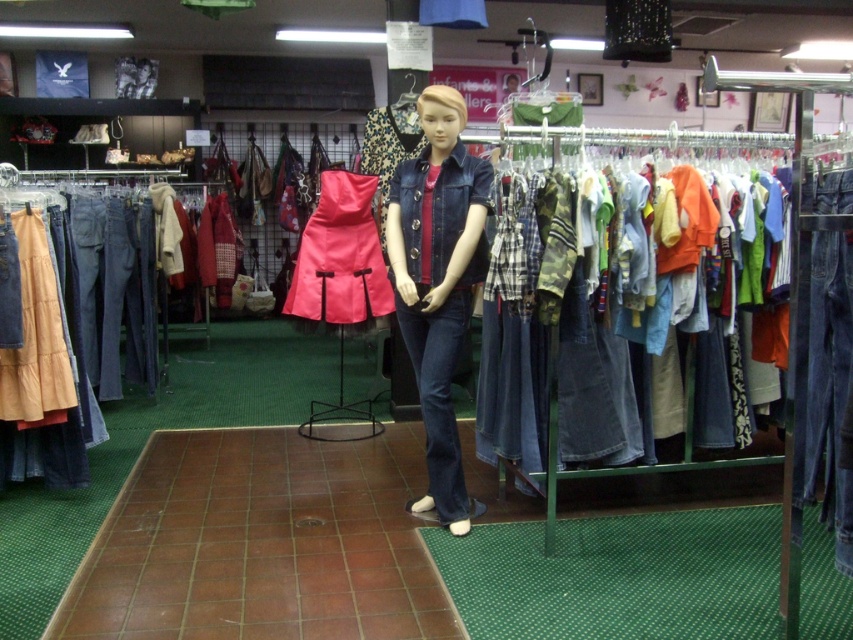
You are standing at the entrance of the clothing store and notice two points marked in the scene. The first point is at coordinates point (90, 369) and the second is at point (329, 321). Based on the store layout, which point is closer to the entrance?

Point (329, 321) is closer to the entrance because it is in front of point (90, 369).

You are a customer in the store looking for a denim jacket. You see the denim shirts at center and the denim jacket at center. According to the store layout, which one is positioned to the right of the other?

The denim shirts at center are to the right of the denim jacket at center.